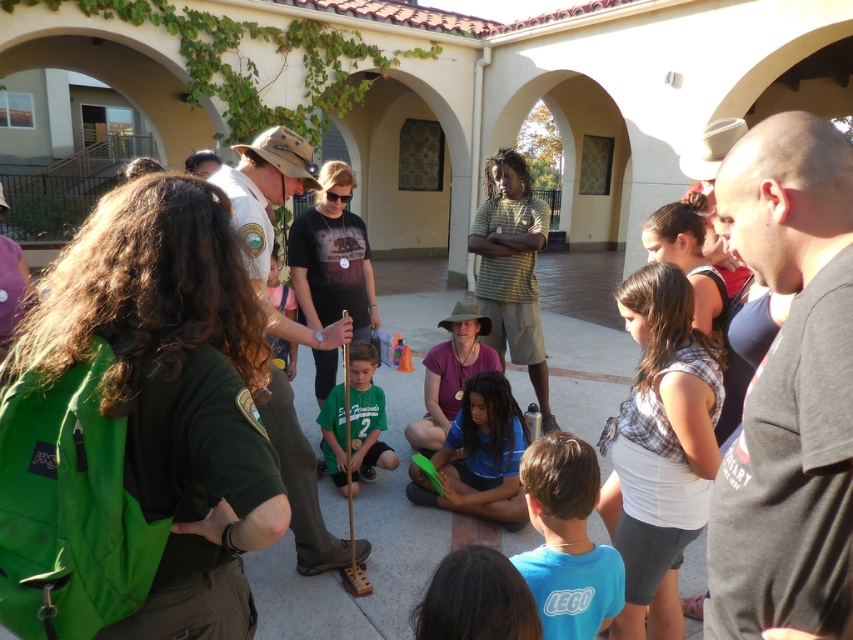
You are standing in the courtyard and want to hand a leaflet to the person wearing the matte purple shirt at center. Which direction should you approach from relative to the green striped shirt at center?

The green striped shirt at center is above the matte purple shirt at center, so you should approach from below the green striped shirt at center to reach the matte purple shirt at center.